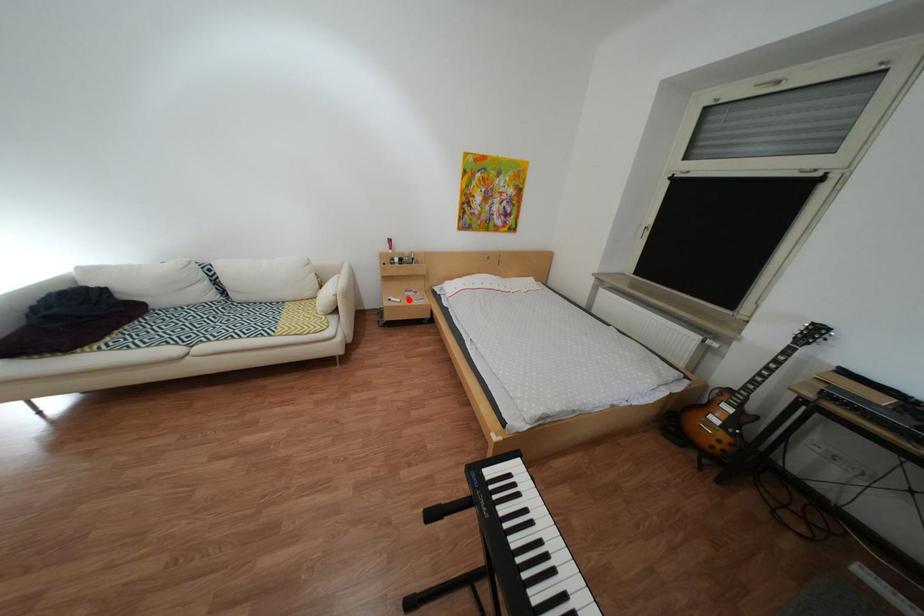
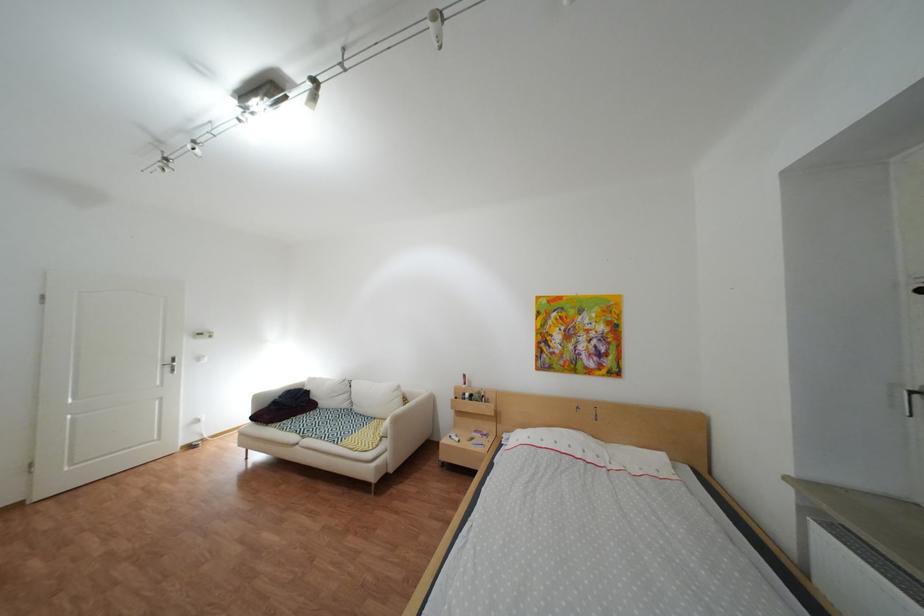
Question: I am providing you with two images of the same scene from different viewpoints. Given a red point in image1, look at the same physical point in image2. Is it:

Choices:
 (A) Closer to the viewpoint
 (B) Farther from the viewpoint

Answer: (B)